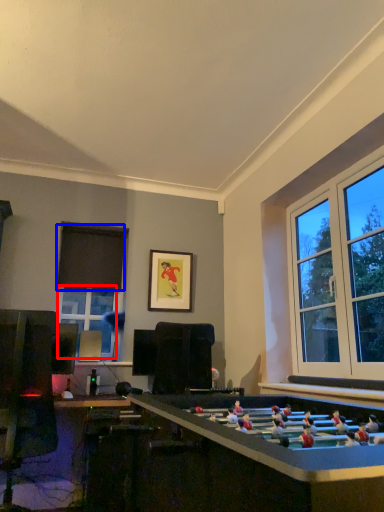
Question: Which object is closer to the camera taking this photo, window (highlighted by a red box) or curtain (highlighted by a blue box)?

Choices:
 (A) window
 (B) curtain

Answer: (A)